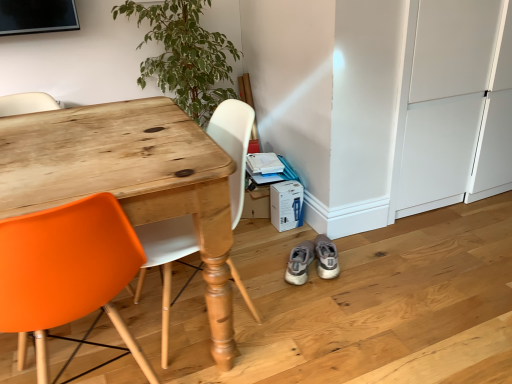
Question: Is light gray suede sneakers at lower center, positioned as the second footwear in left-to-right order, not near green leafy plant at upper left?

Choices:
 (A) yes
 (B) no

Answer: (A)

Question: Is the position of light gray suede sneakers at lower center, the 1th footwear from the right, less distant than that of green leafy plant at upper left?

Choices:
 (A) no
 (B) yes

Answer: (B)

Question: Can you confirm if light gray suede sneakers at lower center, positioned as the second footwear in left-to-right order, is thinner than green leafy plant at upper left?

Choices:
 (A) no
 (B) yes

Answer: (B)

Question: From a real-world perspective, is light gray suede sneakers at lower center, the 1th footwear from the right, physically above green leafy plant at upper left?

Choices:
 (A) yes
 (B) no

Answer: (B)

Question: Is green leafy plant at upper left located within light gray suede sneakers at lower center, positioned as the second footwear in left-to-right order?

Choices:
 (A) yes
 (B) no

Answer: (B)

Question: Is white cardboard box at lower center wider or thinner than wooden desk at left?

Choices:
 (A) wide
 (B) thin

Answer: (B)

Question: Does point (291, 221) appear closer or farther from the camera than point (233, 173)?

Choices:
 (A) farther
 (B) closer

Answer: (A)

Question: From a real-world perspective, relative to wooden desk at left, is white cardboard box at lower center vertically above or below?

Choices:
 (A) below
 (B) above

Answer: (A)

Question: From the image's perspective, is white cardboard box at lower center above or below wooden desk at left?

Choices:
 (A) above
 (B) below

Answer: (A)

Question: In terms of size, does gray suede sneakers at lower right, which ranks as the second footwear in right-to-left order, appear bigger or smaller than white cardboard box at lower center?

Choices:
 (A) big
 (B) small

Answer: (B)

Question: Is gray suede sneakers at lower right, which ranks as the second footwear in right-to-left order, inside the boundaries of white cardboard box at lower center, or outside?

Choices:
 (A) inside
 (B) outside

Answer: (B)

Question: Would you say gray suede sneakers at lower right, which ranks as the second footwear in right-to-left order, is to the left or to the right of white cardboard box at lower center in the picture?

Choices:
 (A) right
 (B) left

Answer: (A)

Question: Considering their positions, is gray suede sneakers at lower right, which is the 1th footwear from left to right, located in front of or behind white cardboard box at lower center?

Choices:
 (A) front
 (B) behind

Answer: (A)

Question: Is light gray suede sneakers at lower center, positioned as the second footwear in left-to-right order, to the left or to the right of green leafy plant at upper left in the image?

Choices:
 (A) right
 (B) left

Answer: (A)

Question: From a real-world perspective, is light gray suede sneakers at lower center, positioned as the second footwear in left-to-right order, above or below green leafy plant at upper left?

Choices:
 (A) above
 (B) below

Answer: (B)